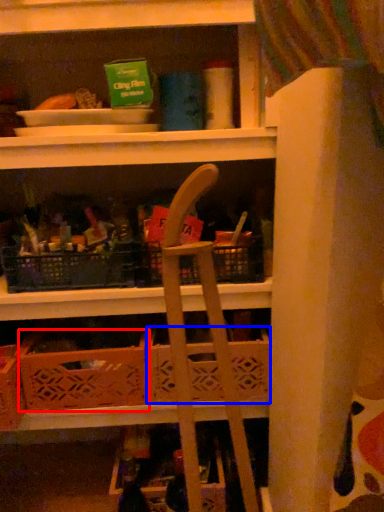
Question: Which object is further to the camera taking this photo, crate (highlighted by a red box) or basket (highlighted by a blue box)?

Choices:
 (A) crate
 (B) basket

Answer: (B)